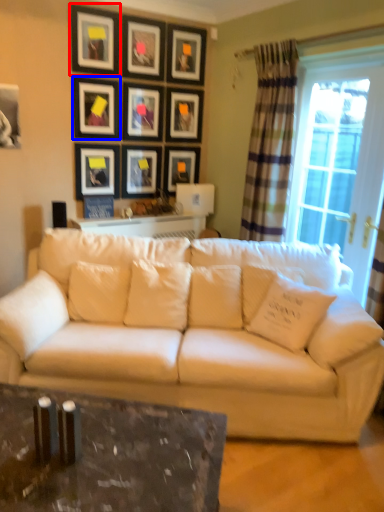
Question: Which object appears farthest to the camera in this image, picture frame (highlighted by a red box) or picture frame (highlighted by a blue box)?

Choices:
 (A) picture frame
 (B) picture frame

Answer: (B)